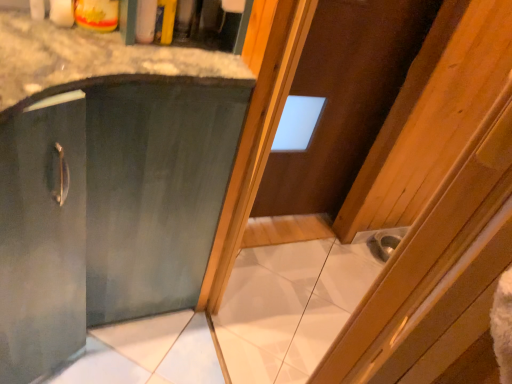
In order to face matte green cabinet at center, should I rotate leftwards or rightwards?

Rotate left and turn 18.755 degrees.

Identify the location of brown wooden door at upper center. Image resolution: width=512 pixels, height=384 pixels. (344, 98).

Can you confirm if brown wooden door at upper center is smaller than metallic silver sink at lower right?

Incorrect, brown wooden door at upper center is not smaller in size than metallic silver sink at lower right.

From a real-world perspective, is brown wooden door at upper center below metallic silver sink at lower right?

Actually, brown wooden door at upper center is physically above metallic silver sink at lower right in the real world.

Is point (359, 36) closer or farther from the camera than point (400, 235)?

Clearly, point (359, 36) is closer to the camera than point (400, 235).

At what (x,y) coordinates should I click in order to perform the action: click on door lying on the left of metallic silver sink at lower right. Please return your answer as a coordinate pair (x, y). This screenshot has height=384, width=512. Looking at the image, I should click on (344, 98).

Would you say brown wooden door at upper center is a long distance from matte green cabinet at center?

brown wooden door at upper center is near matte green cabinet at center, not far away.

From the image's perspective, which is above, brown wooden door at upper center or matte green cabinet at center?

brown wooden door at upper center appears higher in the image.

Is brown wooden door at upper center wider or thinner than matte green cabinet at center?

In the image, brown wooden door at upper center appears to be more narrow than matte green cabinet at center.

Which of these two, brown wooden door at upper center or matte green cabinet at center, stands shorter?

With less height is matte green cabinet at center.

Is metallic silver sink at lower right far from brown wooden door at upper center?

No.

Which object is positioned more to the right, metallic silver sink at lower right or brown wooden door at upper center?

metallic silver sink at lower right is more to the right.

Can you confirm if metallic silver sink at lower right is bigger than brown wooden door at upper center?

No.

Does metallic silver sink at lower right turn towards brown wooden door at upper center?

No, metallic silver sink at lower right is not aimed at brown wooden door at upper center.

What are the coordinates of `sink lying behind the matte green cabinet at center` in the screenshot? It's located at (386, 242).

Can you confirm if metallic silver sink at lower right is wider than matte green cabinet at center?

No.

From the picture: Is metallic silver sink at lower right facing away from matte green cabinet at center?

No, metallic silver sink at lower right is not facing the opposite direction of matte green cabinet at center.

From the image's perspective, who appears lower, metallic silver sink at lower right or matte green cabinet at center?

metallic silver sink at lower right.

Which of these two, matte green cabinet at center or metallic silver sink at lower right, is smaller?

metallic silver sink at lower right is smaller.

Is metallic silver sink at lower right completely or partially inside matte green cabinet at center?

No, metallic silver sink at lower right is located outside of matte green cabinet at center.

Is metallic silver sink at lower right at the back of matte green cabinet at center?

No, metallic silver sink at lower right is not at the back of matte green cabinet at center.

Which is more to the left, matte green cabinet at center or brown wooden door at upper center?

Positioned to the left is matte green cabinet at center.

Who is smaller, matte green cabinet at center or brown wooden door at upper center?

brown wooden door at upper center.

Does matte green cabinet at center have a lesser height compared to brown wooden door at upper center?

Correct, matte green cabinet at center is not as tall as brown wooden door at upper center.

From a real-world perspective, is matte green cabinet at center physically located above or below brown wooden door at upper center?

Clearly, from a real-world perspective, matte green cabinet at center is below brown wooden door at upper center.

Locate an element on the screen. This screenshot has width=512, height=384. door above the metallic silver sink at lower right (from a real-world perspective) is located at coordinates (344, 98).

Locate an element on the screen. cabinetry that appears on the left of brown wooden door at upper center is located at coordinates (x=105, y=182).

Based on their spatial positions, is brown wooden door at upper center or matte green cabinet at center further from metallic silver sink at lower right?

matte green cabinet at center lies further to metallic silver sink at lower right than the other object.

Considering their positions, is matte green cabinet at center positioned closer to brown wooden door at upper center than metallic silver sink at lower right?

Among the two, metallic silver sink at lower right is located nearer to brown wooden door at upper center.

When comparing their distances from brown wooden door at upper center, does metallic silver sink at lower right or matte green cabinet at center seem further?

The object further to brown wooden door at upper center is matte green cabinet at center.

Considering their positions, is metallic silver sink at lower right positioned closer to matte green cabinet at center than brown wooden door at upper center?

Among the two, brown wooden door at upper center is located nearer to matte green cabinet at center.

Which object lies nearer to the anchor point metallic silver sink at lower right, matte green cabinet at center or brown wooden door at upper center?

brown wooden door at upper center is positioned closer to the anchor metallic silver sink at lower right.

From the image, which object appears to be nearer to matte green cabinet at center, brown wooden door at upper center or metallic silver sink at lower right?

brown wooden door at upper center is closer to matte green cabinet at center.

Identify the location of door between matte green cabinet at center and metallic silver sink at lower right in the front-back direction. (344, 98).